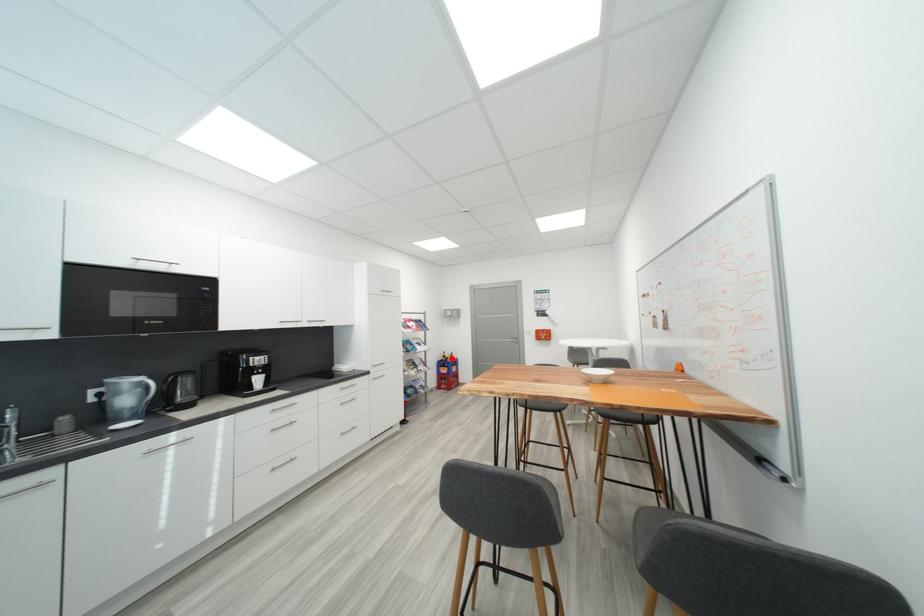
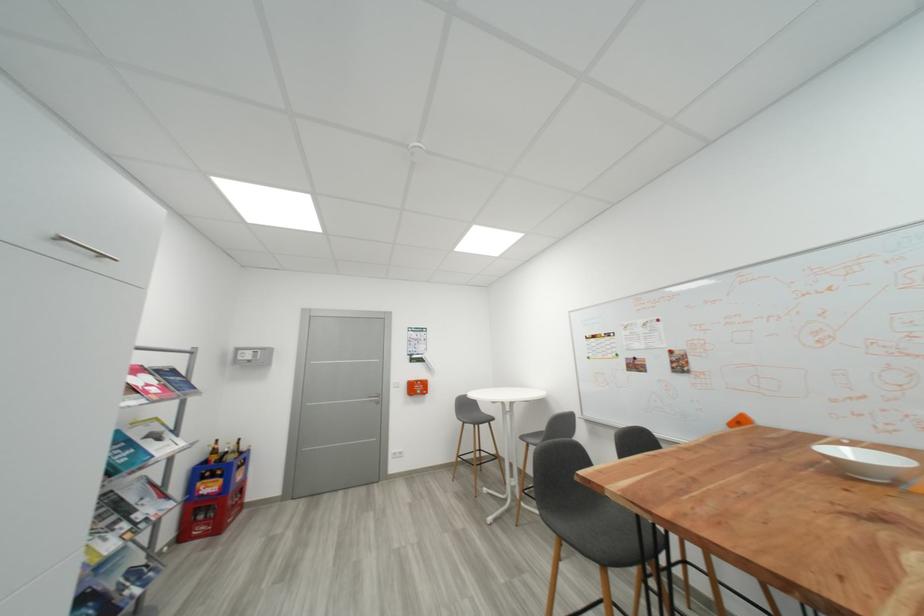
Where in the second image is the point corresponding to the highlighted location from the first image?

(223, 454)